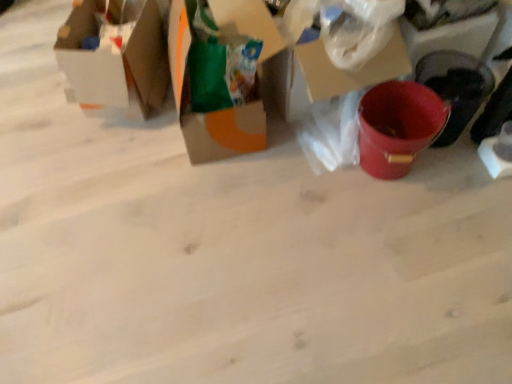
What do you see at coordinates (220, 74) in the screenshot? I see `cardboard box at center, the 2th box viewed from the left` at bounding box center [220, 74].

What are the coordinates of `cardboard box at center, the 1th box when ordered from right to left` in the screenshot? It's located at (220, 74).

Measure the distance between matte cardboard box at upper left, which ranks as the second box in right-to-left order, and camera.

matte cardboard box at upper left, which ranks as the second box in right-to-left order, and camera are 5.10 feet apart from each other.

What do you see at coordinates (115, 58) in the screenshot?
I see `matte cardboard box at upper left, the 1th box viewed from the left` at bounding box center [115, 58].

Locate an element on the screen. The image size is (512, 384). matte cardboard box at upper left, which ranks as the second box in right-to-left order is located at coordinates (115, 58).

You are a GUI agent. You are given a task and a screenshot of the screen. Output one action in this format:
    pyautogui.click(x=<x>, y=<y>)
    Task: Click on the cardboard box at center, the 2th box viewed from the left
    The image size is (512, 384).
    Given the screenshot: What is the action you would take?
    tap(220, 74)

Can you confirm if cardboard box at center, the 2th box viewed from the left, is positioned to the left of matte cardboard box at upper left, the 1th box viewed from the left?

In fact, cardboard box at center, the 2th box viewed from the left, is to the right of matte cardboard box at upper left, the 1th box viewed from the left.

Between cardboard box at center, the 2th box viewed from the left, and matte cardboard box at upper left, which ranks as the second box in right-to-left order, which one is positioned behind?

matte cardboard box at upper left, which ranks as the second box in right-to-left order.

Does point (202, 75) come behind point (138, 19)?

That is False.

From the image's perspective, is cardboard box at center, the 1th box when ordered from right to left, positioned above or below matte cardboard box at upper left, the 1th box viewed from the left?

Clearly, from the image's perspective, cardboard box at center, the 1th box when ordered from right to left, is below matte cardboard box at upper left, the 1th box viewed from the left.

From a real-world perspective, is cardboard box at center, the 2th box viewed from the left, positioned under matte cardboard box at upper left, which ranks as the second box in right-to-left order, based on gravity?

Incorrect, from a real-world perspective, cardboard box at center, the 2th box viewed from the left, is higher than matte cardboard box at upper left, which ranks as the second box in right-to-left order.

In terms of width, does cardboard box at center, the 1th box when ordered from right to left, look wider or thinner when compared to matte cardboard box at upper left, which ranks as the second box in right-to-left order?

Clearly, cardboard box at center, the 1th box when ordered from right to left, has more width compared to matte cardboard box at upper left, which ranks as the second box in right-to-left order.

Considering the sizes of objects cardboard box at center, the 2th box viewed from the left, and matte cardboard box at upper left, which ranks as the second box in right-to-left order, in the image provided, who is shorter, cardboard box at center, the 2th box viewed from the left, or matte cardboard box at upper left, which ranks as the second box in right-to-left order,?

matte cardboard box at upper left, which ranks as the second box in right-to-left order, is shorter.

Can you confirm if cardboard box at center, the 2th box viewed from the left, is bigger than matte cardboard box at upper left, which ranks as the second box in right-to-left order?

Indeed, cardboard box at center, the 2th box viewed from the left, has a larger size compared to matte cardboard box at upper left, which ranks as the second box in right-to-left order.

Looking at this image, is cardboard box at center, the 2th box viewed from the left, spatially inside matte cardboard box at upper left, the 1th box viewed from the left, or outside of it?

The correct answer is: outside.

Is cardboard box at center, the 1th box when ordered from right to left, not close to matte cardboard box at upper left, which ranks as the second box in right-to-left order?

Actually, cardboard box at center, the 1th box when ordered from right to left, and matte cardboard box at upper left, which ranks as the second box in right-to-left order, are a little close together.

Could you tell me if cardboard box at center, the 2th box viewed from the left, is turned towards matte cardboard box at upper left, the 1th box viewed from the left?

No, cardboard box at center, the 2th box viewed from the left, is not turned towards matte cardboard box at upper left, the 1th box viewed from the left.

From the picture: What's the angular difference between cardboard box at center, the 1th box when ordered from right to left, and matte cardboard box at upper left, the 1th box viewed from the left,'s facing directions?

cardboard box at center, the 1th box when ordered from right to left, and matte cardboard box at upper left, the 1th box viewed from the left, are facing 19.6 degrees away from each other.

This screenshot has height=384, width=512. In order to click on box that is on the left side of cardboard box at center, the 2th box viewed from the left in this screenshot , I will do pos(115,58).

Consider the image. Considering the relative positions of matte cardboard box at upper left, the 1th box viewed from the left, and cardboard box at center, the 2th box viewed from the left, in the image provided, is matte cardboard box at upper left, the 1th box viewed from the left, to the left or to the right of cardboard box at center, the 2th box viewed from the left,?

matte cardboard box at upper left, the 1th box viewed from the left, is to the left of cardboard box at center, the 2th box viewed from the left.

Considering their positions, is matte cardboard box at upper left, which ranks as the second box in right-to-left order, located in front of or behind cardboard box at center, the 2th box viewed from the left?

Clearly, matte cardboard box at upper left, which ranks as the second box in right-to-left order, is behind cardboard box at center, the 2th box viewed from the left.

Does point (76, 16) come farther from viewer compared to point (177, 61)?

Yes.

From the image's perspective, who appears lower, matte cardboard box at upper left, which ranks as the second box in right-to-left order, or cardboard box at center, the 1th box when ordered from right to left?

From the image's view, cardboard box at center, the 1th box when ordered from right to left, is below.

From a real-world perspective, is matte cardboard box at upper left, the 1th box viewed from the left, located beneath cardboard box at center, the 2th box viewed from the left?

Yes, from a real-world perspective, matte cardboard box at upper left, the 1th box viewed from the left, is under cardboard box at center, the 2th box viewed from the left.

Considering the sizes of matte cardboard box at upper left, the 1th box viewed from the left, and cardboard box at center, the 2th box viewed from the left, in the image, is matte cardboard box at upper left, the 1th box viewed from the left, wider or thinner than cardboard box at center, the 2th box viewed from the left,?

matte cardboard box at upper left, the 1th box viewed from the left, is thinner than cardboard box at center, the 2th box viewed from the left.

Between matte cardboard box at upper left, which ranks as the second box in right-to-left order, and cardboard box at center, the 1th box when ordered from right to left, which one has more height?

With more height is cardboard box at center, the 1th box when ordered from right to left.

Who is smaller, matte cardboard box at upper left, the 1th box viewed from the left, or cardboard box at center, the 2th box viewed from the left?

matte cardboard box at upper left, the 1th box viewed from the left, is smaller.

Is matte cardboard box at upper left, which ranks as the second box in right-to-left order, situated inside cardboard box at center, the 1th box when ordered from right to left, or outside?

matte cardboard box at upper left, which ranks as the second box in right-to-left order, is outside cardboard box at center, the 1th box when ordered from right to left.

Would you consider matte cardboard box at upper left, which ranks as the second box in right-to-left order, to be distant from cardboard box at center, the 1th box when ordered from right to left?

They are positioned close to each other.

Is matte cardboard box at upper left, which ranks as the second box in right-to-left order, positioned with its back to cardboard box at center, the 1th box when ordered from right to left?

Absolutely, matte cardboard box at upper left, which ranks as the second box in right-to-left order, is directed away from cardboard box at center, the 1th box when ordered from right to left.

How different are the orientations of matte cardboard box at upper left, which ranks as the second box in right-to-left order, and cardboard box at center, the 1th box when ordered from right to left, in degrees?

matte cardboard box at upper left, which ranks as the second box in right-to-left order, and cardboard box at center, the 1th box when ordered from right to left, are facing 19.6 degrees away from each other.

At what (x,y) coordinates should I click in order to perform the action: click on box below the matte cardboard box at upper left, the 1th box viewed from the left (from the image's perspective). Please return your answer as a coordinate pair (x, y). Image resolution: width=512 pixels, height=384 pixels. Looking at the image, I should click on (220, 74).

In order to click on box behind the cardboard box at center, the 2th box viewed from the left in this screenshot , I will do `click(115, 58)`.

You are a GUI agent. You are given a task and a screenshot of the screen. Output one action in this format:
    pyautogui.click(x=<x>, y=<y>)
    Task: Click on the box located in front of the matte cardboard box at upper left, which ranks as the second box in right-to-left order
    The height and width of the screenshot is (384, 512).
    Given the screenshot: What is the action you would take?
    pyautogui.click(x=220, y=74)